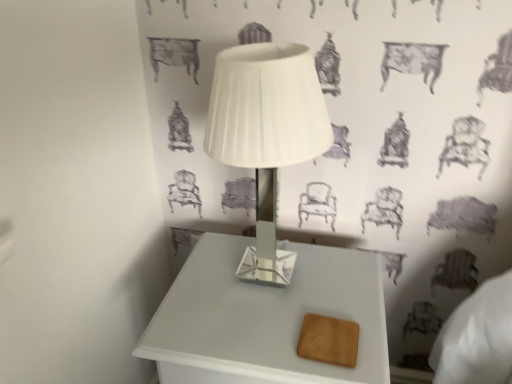
Where is `vacant space to the left of white glossy lamp at center`? The image size is (512, 384). vacant space to the left of white glossy lamp at center is located at coordinates (192, 285).